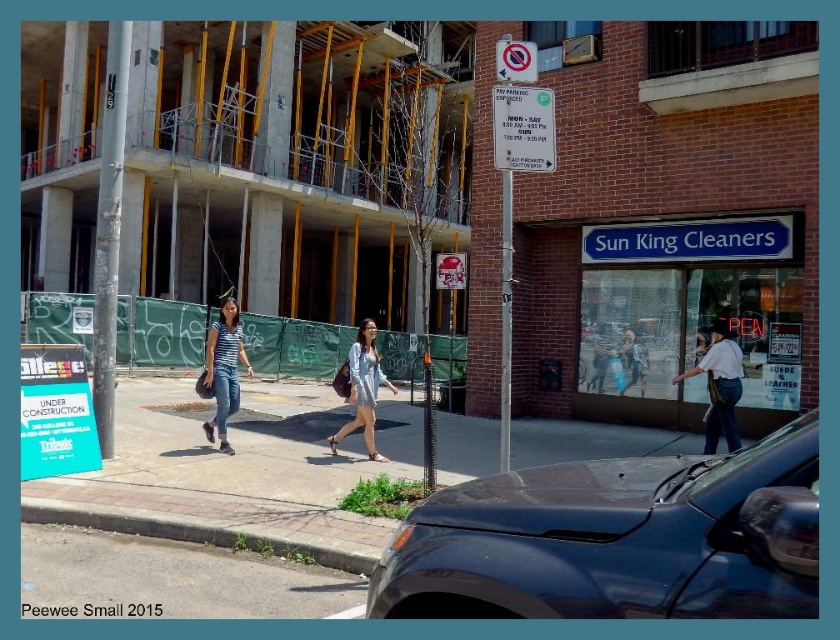
Consider the image. Does glossy black car at lower right come in front of matte blue dress at center?

Yes, it is in front of matte blue dress at center.

Does glossy black car at lower right have a smaller size compared to matte blue dress at center?

Yes, glossy black car at lower right is smaller than matte blue dress at center.

Which is behind, point (481, 520) or point (361, 353)?

Positioned behind is point (361, 353).

You are a GUI agent. You are given a task and a screenshot of the screen. Output one action in this format:
    pyautogui.click(x=<x>, y=<y>)
    Task: Click on the glossy black car at lower right
    This screenshot has height=640, width=840.
    Given the screenshot: What is the action you would take?
    pyautogui.click(x=617, y=540)

Does glossy black car at lower right have a greater width compared to striped cotton shirt at center?

Incorrect, glossy black car at lower right's width does not surpass striped cotton shirt at center's.

Can you confirm if glossy black car at lower right is positioned to the right of striped cotton shirt at center?

Yes, glossy black car at lower right is to the right of striped cotton shirt at center.

Image resolution: width=840 pixels, height=640 pixels. Describe the element at coordinates (617, 540) in the screenshot. I see `glossy black car at lower right` at that location.

At what (x,y) coordinates should I click in order to perform the action: click on glossy black car at lower right. Please return your answer as a coordinate pair (x, y). Looking at the image, I should click on (617, 540).

Does white paper sign at upper center come in front of white cotton shirt at center?

That is True.

From the picture: Who is more forward, (x=534, y=134) or (x=735, y=436)?

Point (x=534, y=134) is in front.

Who is more distant from viewer, (533, 157) or (707, 428)?

Point (707, 428)

Image resolution: width=840 pixels, height=640 pixels. In order to click on white paper sign at upper center in this screenshot , I will do `click(523, 129)`.